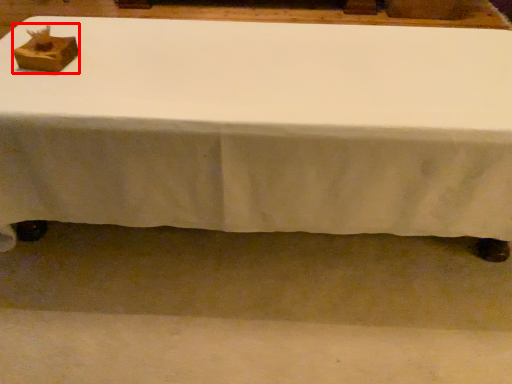
Question: From the image's perspective, what is the correct spatial relationship of shoe box (annotated by the red box) in relation to table?

Choices:
 (A) above
 (B) below

Answer: (B)